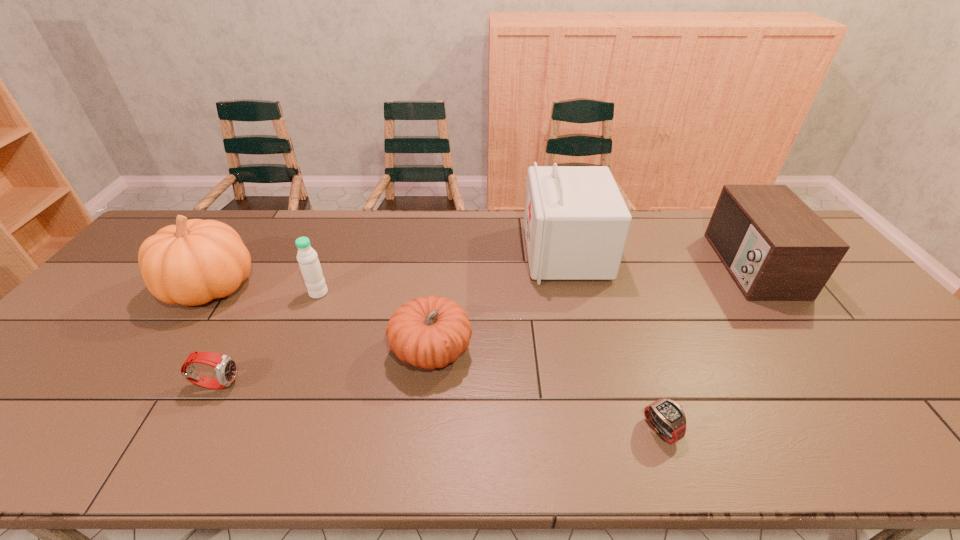
Locate an element on the screen. vacant area situated on the face of the taller watch is located at coordinates (302, 383).

This screenshot has height=540, width=960. What are the coordinates of `vacant position located 0.050m on the right of the nearest object` in the screenshot? It's located at (699, 430).

I want to click on the first-aid kit that is at the far edge, so click(x=576, y=223).

Where is `radio receiver located in the far edge section of the desktop`? Image resolution: width=960 pixels, height=540 pixels. radio receiver located in the far edge section of the desktop is located at coordinates (776, 248).

Find the location of `object that is at the near edge`. object that is at the near edge is located at coordinates (667, 417).

The image size is (960, 540). Find the location of `object at the left edge`. object at the left edge is located at coordinates 191,263.

You are a GUI agent. You are given a task and a screenshot of the screen. Output one action in this format:
    pyautogui.click(x=<x>, y=<y>)
    Task: Click on the object present at the right edge
    The width and height of the screenshot is (960, 540).
    Given the screenshot: What is the action you would take?
    pyautogui.click(x=776, y=248)

Find the location of a particular element. This screenshot has height=540, width=960. object present at the far right corner is located at coordinates (776, 248).

This screenshot has height=540, width=960. Identify the location of vacant space at the far edge. (410, 235).

In the image, there is a desktop. In order to click on free region at the near edge in this screenshot , I will do `click(920, 446)`.